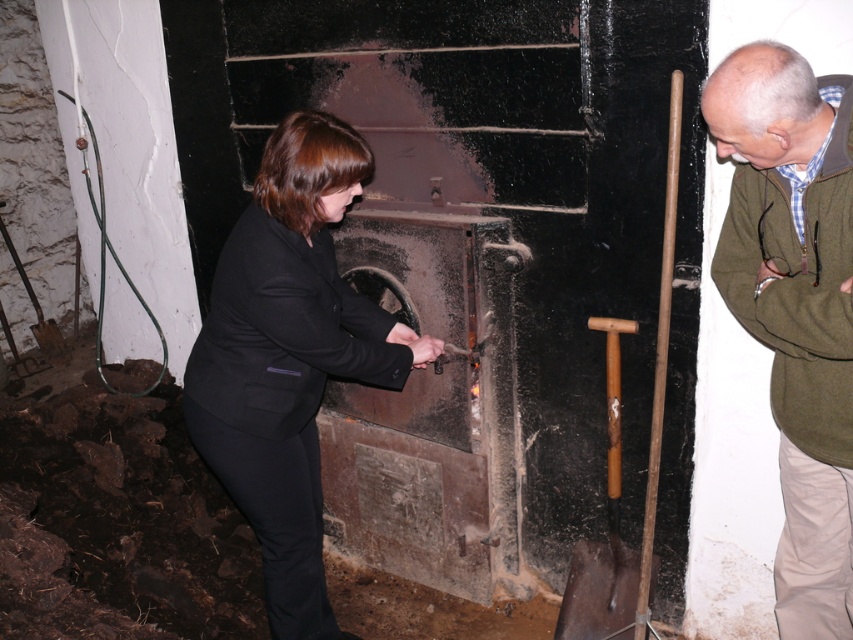
You are standing in a dimly lit basement with a large furnace. There are two points marked in the scene. One is at coordinate point [737,177] and the other at point [608,387]. Which point is closer to the furnace door?

Point [737,177] is in front of point [608,387], meaning it is closer to the furnace door.